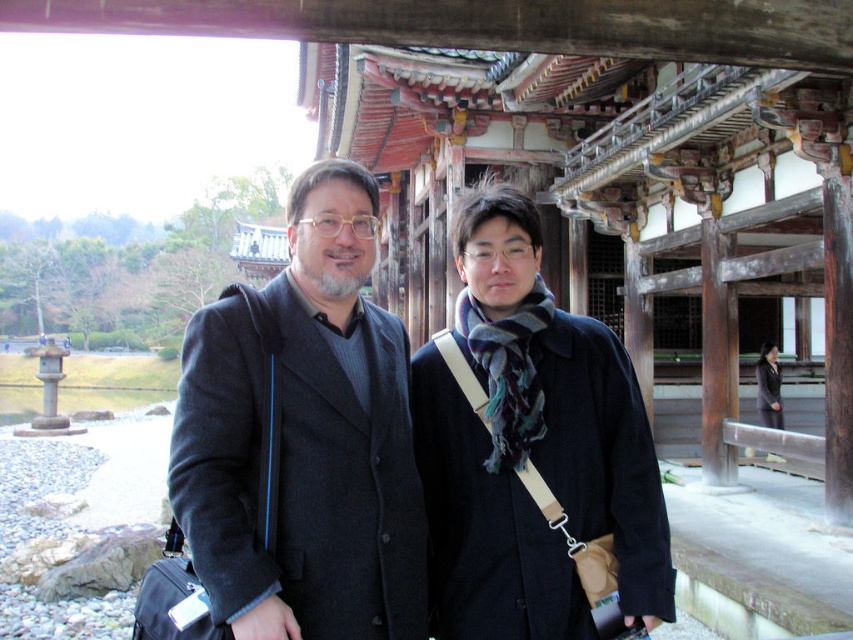
Does dark gray wool coat at center appear under black fabric coat at right?

Incorrect, dark gray wool coat at center is not positioned below black fabric coat at right.

Is dark gray wool coat at center thinner than black fabric coat at right?

No.

Does point (288, 243) come farther from viewer compared to point (773, 412)?

No, (288, 243) is in front of (773, 412).

What are the coordinates of `dark gray wool coat at center` in the screenshot? It's located at (305, 436).